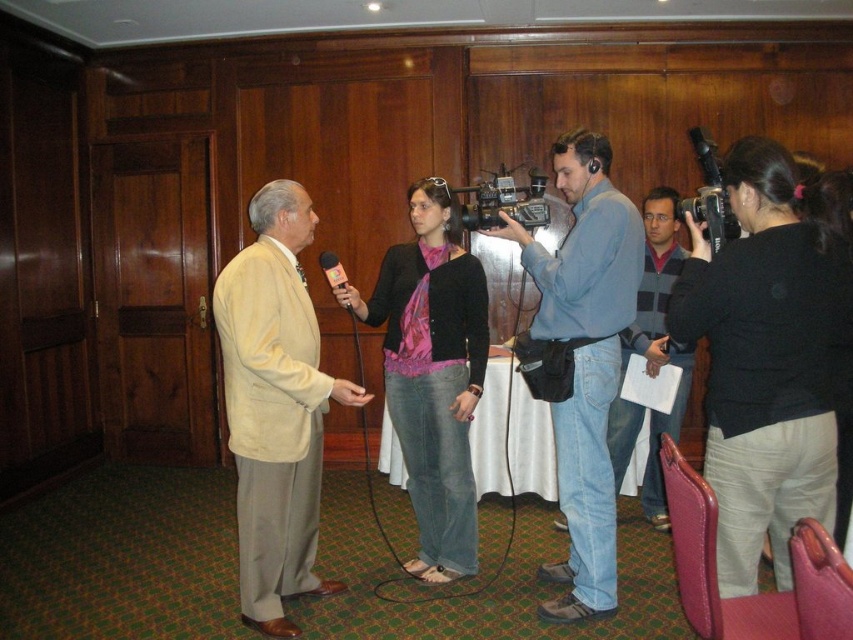
Question: Does beige fabric suit at center appear under blue jeans at center?

Choices:
 (A) yes
 (B) no

Answer: (A)

Question: Can you confirm if blue jeans at center is smaller than metallic pink microphone at center?

Choices:
 (A) yes
 (B) no

Answer: (B)

Question: Which point is farther from the camera taking this photo?

Choices:
 (A) (682, 401)
 (B) (270, 449)
 (C) (637, 237)

Answer: (A)

Question: Which of the following is the closest to the observer?

Choices:
 (A) (563, 333)
 (B) (260, 481)
 (C) (329, 282)

Answer: (B)

Question: Which object is closer to the camera taking this photo?

Choices:
 (A) metallic pink microphone at center
 (B) blue denim jeans at center
 (C) blue jeans at center
 (D) beige fabric suit at center

Answer: (D)

Question: Does blue jeans at center appear on the right side of metallic pink microphone at center?

Choices:
 (A) yes
 (B) no

Answer: (A)